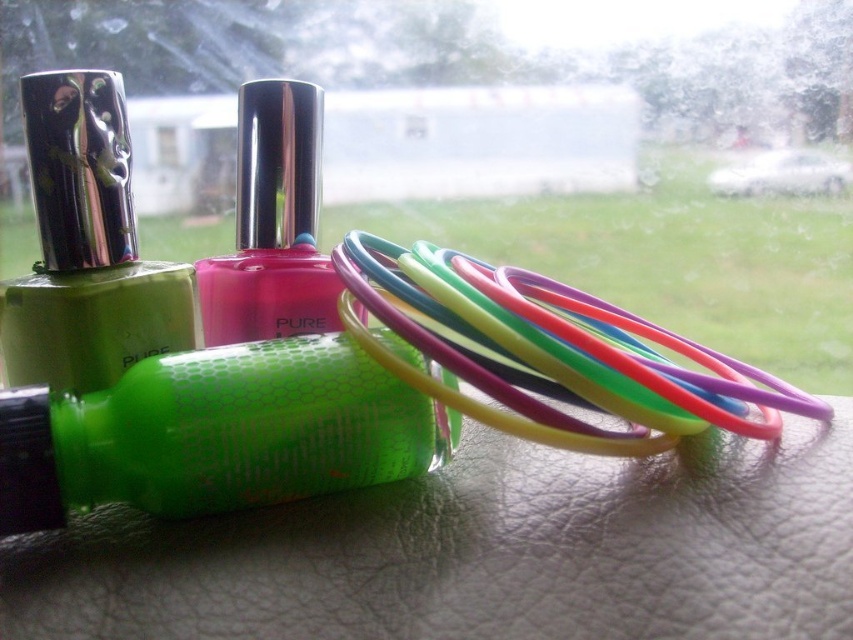
Question: Is matte green nail polish at left below pink glossy nail polish at center?

Choices:
 (A) yes
 (B) no

Answer: (A)

Question: Is neon green glossy nail polish at center to the right of pink glossy nail polish at center from the viewer's perspective?

Choices:
 (A) no
 (B) yes

Answer: (B)

Question: Does rubber bands at center have a lesser width compared to metallic silver lipstick at center?

Choices:
 (A) no
 (B) yes

Answer: (A)

Question: Which point is closer to the camera?

Choices:
 (A) (318, 412)
 (B) (584, 333)
 (C) (56, 170)

Answer: (A)

Question: Among these objects, which one is farthest from the camera?

Choices:
 (A) pink glossy nail polish at center
 (B) rubber bands at center

Answer: (A)

Question: Among these points, which one is nearest to the camera?

Choices:
 (A) (114, 173)
 (B) (213, 300)
 (C) (141, 296)

Answer: (C)